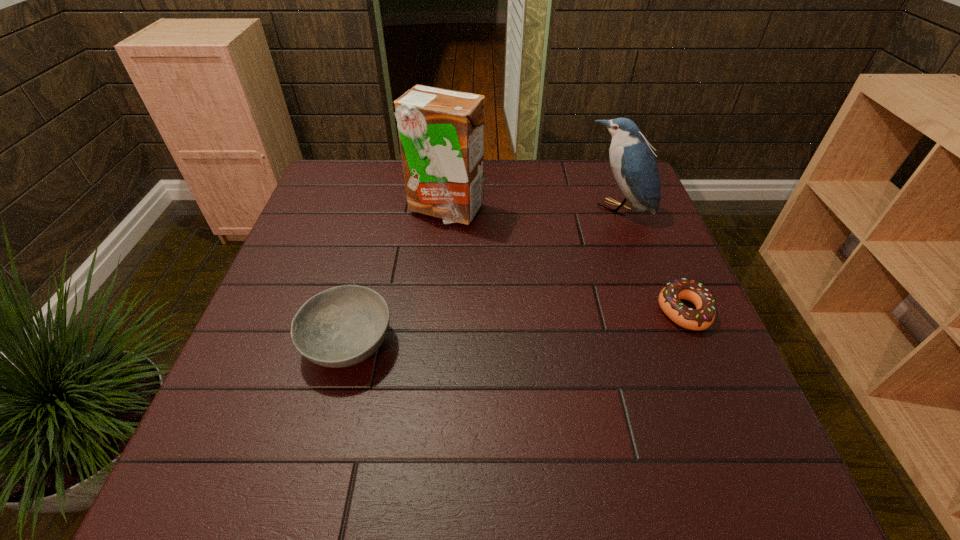
Find the location of a particular element. This screenshot has height=540, width=960. free space located 0.380m on the straw side of the tallest object is located at coordinates (513, 333).

Where is `vacant area situated 0.100m on the straw side of the tallest object`? The height and width of the screenshot is (540, 960). vacant area situated 0.100m on the straw side of the tallest object is located at coordinates (469, 251).

Identify the location of bird situated at the far edge. (632, 160).

Find the location of `carton that is at the far edge`. carton that is at the far edge is located at coordinates (441, 132).

The width and height of the screenshot is (960, 540). What are the coordinates of `object positioned at the left edge` in the screenshot? It's located at (342, 326).

Locate an element on the screen. doughnut at the right edge is located at coordinates click(x=701, y=318).

Identify the location of bird present at the right edge. (632, 160).

At what (x,y) coordinates should I click in order to perform the action: click on object that is at the far right corner. Please return your answer as a coordinate pair (x, y). The image size is (960, 540). Looking at the image, I should click on (632, 160).

Where is `free space at the far edge of the desktop`? Image resolution: width=960 pixels, height=540 pixels. free space at the far edge of the desktop is located at coordinates (524, 178).

You are a GUI agent. You are given a task and a screenshot of the screen. Output one action in this format:
    pyautogui.click(x=<x>, y=<y>)
    Task: Click on the free spot at the near edge of the desktop
    
    Given the screenshot: What is the action you would take?
    pyautogui.click(x=483, y=392)